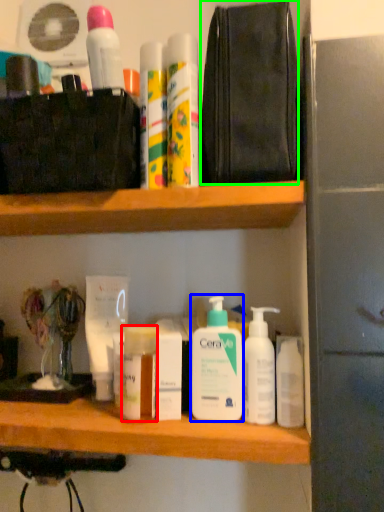
Question: Which object is the farthest from toiletry (highlighted by a red box)? Choose among these: cleaning product (highlighted by a blue box) or pouch (highlighted by a green box).

Choices:
 (A) cleaning product
 (B) pouch

Answer: (B)